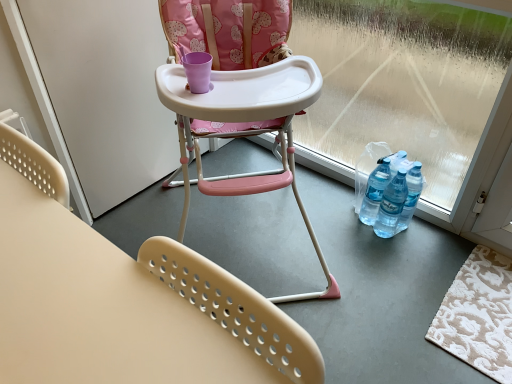
Locate an element on the screen. The image size is (512, 384). free location above beige textured rug at lower right (from a real-world perspective) is located at coordinates (480, 305).